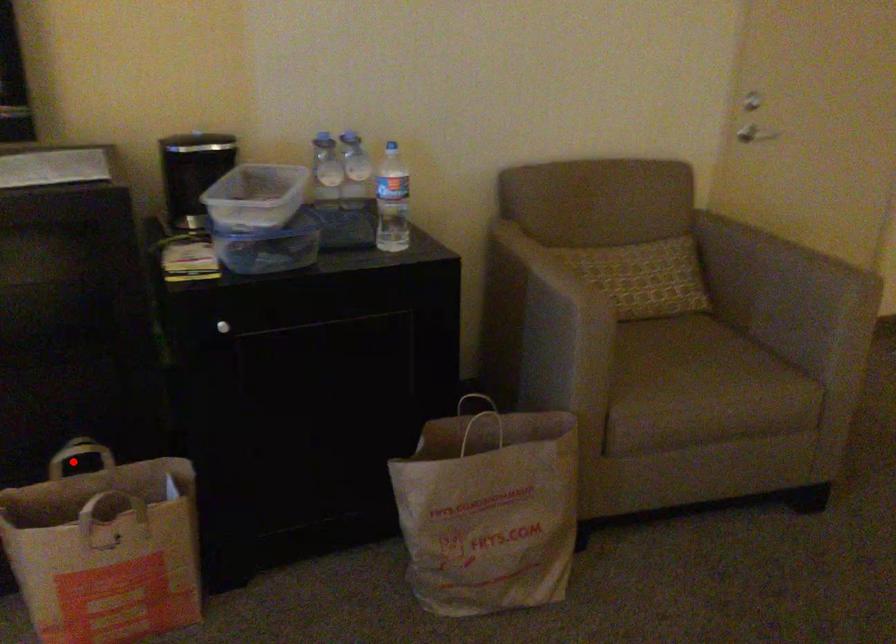
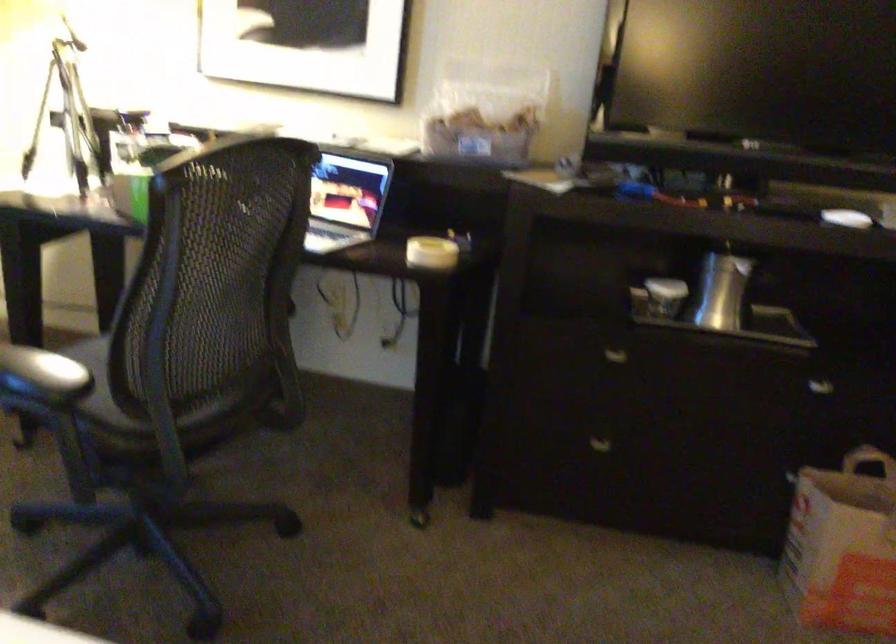
Question: I am providing you with two images of the same scene from different viewpoints. A red point is shown in image1. For the corresponding object point in image2, is it positioned nearer or farther from the camera?

Choices:
 (A) Nearer
 (B) Farther

Answer: (B)